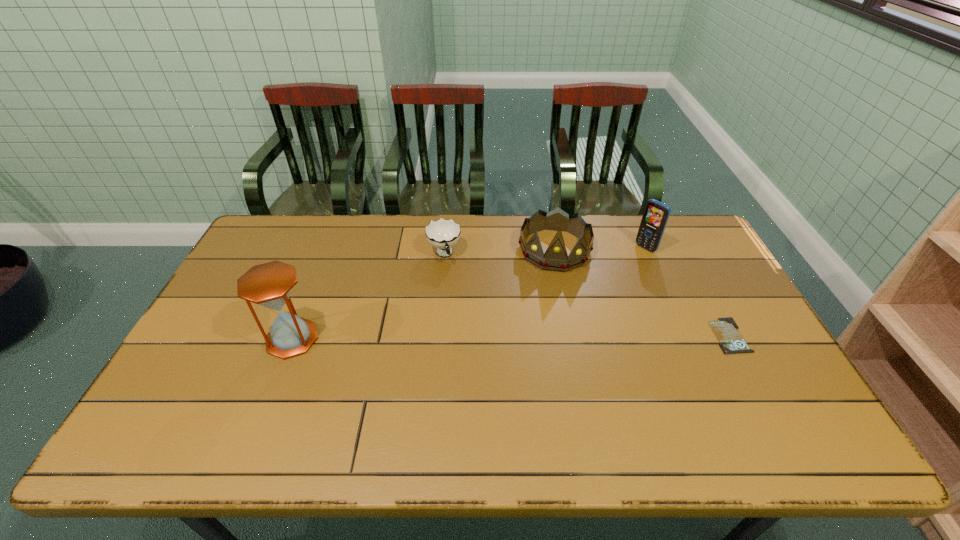
The image size is (960, 540). Identify the location of vacant space situated 0.150m at the front of the tiara with jewels. (552, 307).

I want to click on vacant space situated at the front of the tiara with jewels, so click(x=553, y=291).

Where is `free space located at the front of the tiara with jewels`? This screenshot has width=960, height=540. free space located at the front of the tiara with jewels is located at coordinates (551, 322).

Image resolution: width=960 pixels, height=540 pixels. Identify the location of vacant region located on the side of the cup with the handle. (467, 321).

The width and height of the screenshot is (960, 540). I want to click on vacant region located on the side of the cup with the handle, so click(x=471, y=337).

What are the coordinates of `free space located on the side of the cup with the handle` in the screenshot? It's located at (454, 287).

Find the location of a particular element. vacant point located 0.180m on the screen of the cellular telephone is located at coordinates (610, 276).

This screenshot has width=960, height=540. What are the coordinates of `free space located on the screen of the cellular telephone` in the screenshot? It's located at (598, 285).

You are a GUI agent. You are given a task and a screenshot of the screen. Output one action in this format:
    pyautogui.click(x=<x>, y=<y>)
    Task: Click on the free spot located on the screen of the cellular telephone
    
    Given the screenshot: What is the action you would take?
    627,262

The height and width of the screenshot is (540, 960). What are the coordinates of `tiara at the far edge` in the screenshot? It's located at (555, 258).